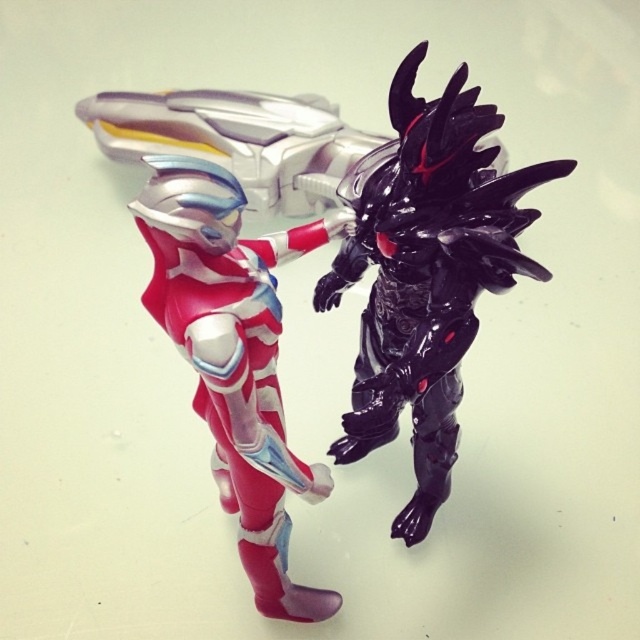
Can you confirm if shiny metallic robot at center is shorter than glossy black figure at right?

Incorrect, shiny metallic robot at center's height does not fall short of glossy black figure at right's.

Between shiny metallic robot at center and glossy black figure at right, which one appears on the left side from the viewer's perspective?

shiny metallic robot at center

Describe the element at coordinates (324, 291) in the screenshot. I see `shiny metallic robot at center` at that location.

Identify the location of shiny metallic robot at center. (324, 291).

Does point (394, 339) lie behind point (273, 410)?

Yes.

Does point (538, 214) come closer to viewer compared to point (248, 307)?

That is False.

Does point (454, 275) come behind point (131, 202)?

Yes, point (454, 275) is behind point (131, 202).

Locate an element on the screen. The height and width of the screenshot is (640, 640). glossy black figure at right is located at coordinates (426, 273).

Is shiny metallic robot at center further to camera compared to shiny metallic suit at center?

That is True.

Is point (221, 492) closer to camera compared to point (269, 291)?

No, (221, 492) is further to viewer.

Locate an element on the screen. This screenshot has height=640, width=640. shiny metallic robot at center is located at coordinates 324,291.